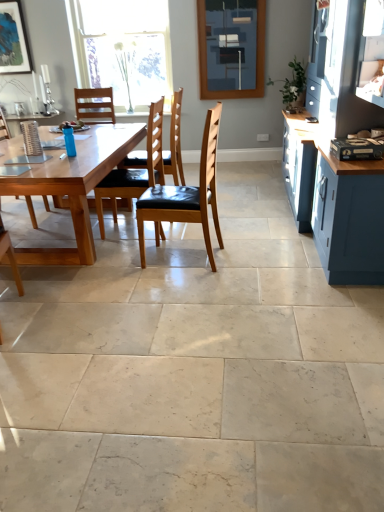
Locate an element on the screen. free area in between brown leather chair at center, the first chair from the right, and matte blue cabinet at right is located at coordinates (248, 227).